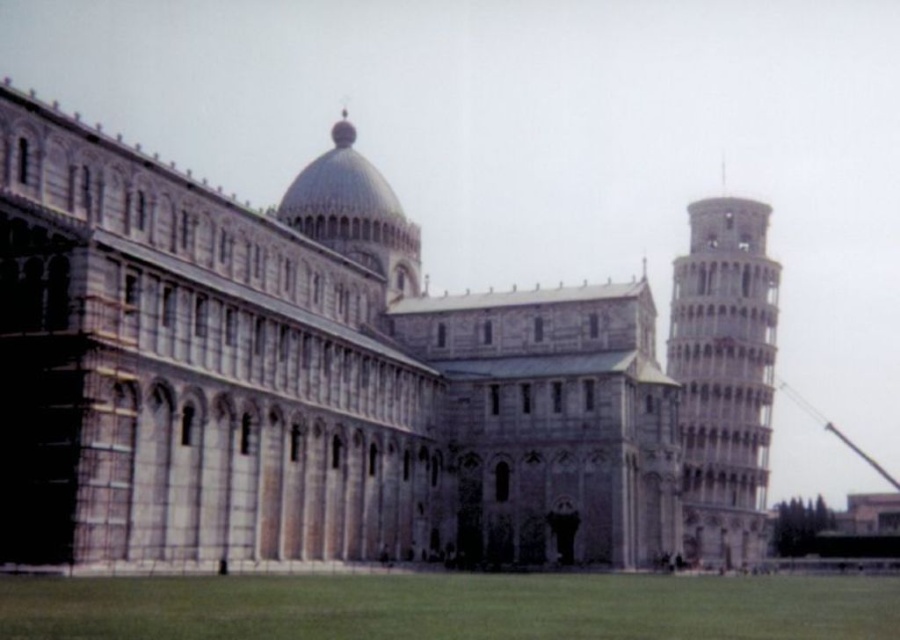
You are standing in Piazza dei Miracoli and want to take a photo of the Leaning Tower of Pisa. You notice a point at coordinates (353, 378). Is this point on the Leaning Tower of Pisa or the Cathedral?

The point at coordinates (353, 378) is on the stone cathedral at center, not the Leaning Tower of Pisa.

You are standing in the Piazza dei Miracoli and want to take a photo of both the stone cathedral at center and the light gray stone tower at right. Based on their positions, which structure will appear larger in your photo?

The stone cathedral at center will appear larger in the photo because it is closer to the viewer than the light gray stone tower at right.

You are a tourist visiting Piazza dei Miracoli and want to take a photo that includes both the stone cathedral at center and the light gray stone tower at right. Based on their heights, which structure should you position closer to the camera to ensure both are fully visible in the frame?

The stone cathedral at center is not as tall as the light gray stone tower at right, so you should position the stone cathedral at center closer to the camera to ensure both structures are fully visible in the frame.